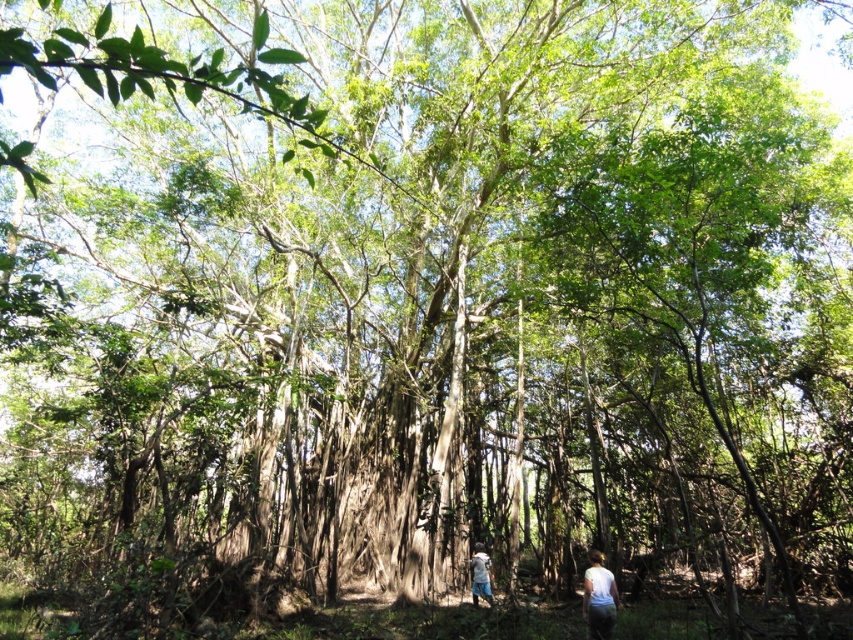
Question: Which of the following is the farthest from the observer?

Choices:
 (A) [604, 621]
 (B) [483, 584]

Answer: (B)

Question: In this image, where is white matte shirt at lower right located relative to white cotton shirt at lower center?

Choices:
 (A) below
 (B) above

Answer: (B)

Question: Is the position of white matte shirt at lower right less distant than that of white cotton shirt at lower center?

Choices:
 (A) yes
 (B) no

Answer: (A)

Question: Among these objects, which one is nearest to the camera?

Choices:
 (A) white cotton shirt at lower center
 (B) white matte shirt at lower right

Answer: (B)

Question: Does white matte shirt at lower right appear over white cotton shirt at lower center?

Choices:
 (A) yes
 (B) no

Answer: (A)